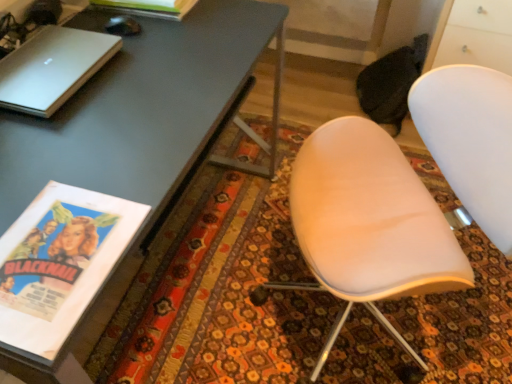
Image resolution: width=512 pixels, height=384 pixels. In order to click on free spot to the right of black glossy mouse at upper left in this screenshot , I will do `click(177, 33)`.